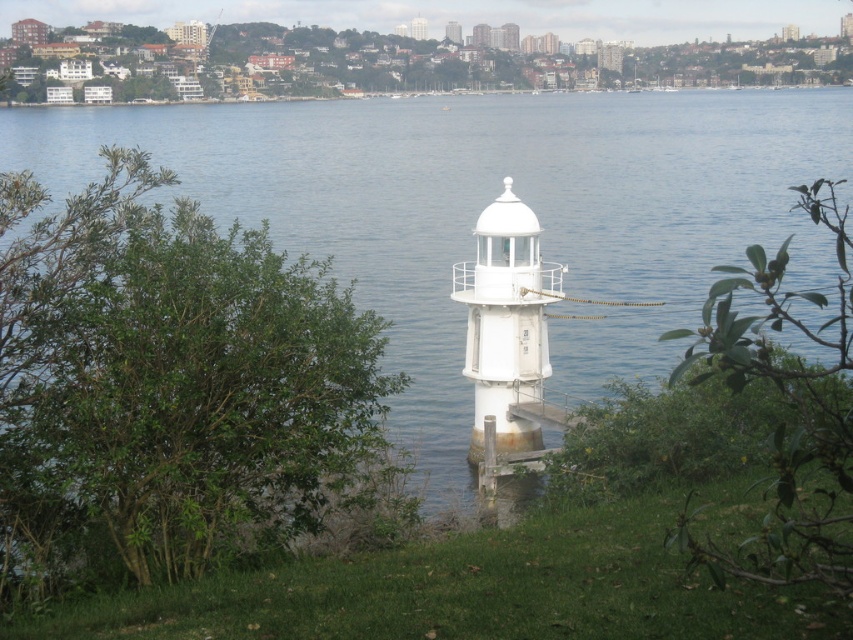
Is transparent water at center shorter than white matte/lightweight tower at center?

No, transparent water at center is not shorter than white matte/lightweight tower at center.

Can you confirm if transparent water at center is taller than white matte/lightweight tower at center?

Yes, transparent water at center is taller than white matte/lightweight tower at center.

Who is more distant from viewer, (248, 209) or (556, 272)?

Positioned behind is point (248, 209).

Image resolution: width=853 pixels, height=640 pixels. Identify the location of transparent water at center. (483, 205).

At what (x,y) coordinates should I click in order to perform the action: click on white matte/lightweight tower at center. Please return your answer as a coordinate pair (x, y). This screenshot has width=853, height=640. Looking at the image, I should click on (x=508, y=324).

Which is above, white matte/lightweight tower at center or white smooth tower at center?

white smooth tower at center is above.

The width and height of the screenshot is (853, 640). Describe the element at coordinates (508, 324) in the screenshot. I see `white matte/lightweight tower at center` at that location.

Locate an element on the screen. white matte/lightweight tower at center is located at coordinates (508, 324).

Which is below, transparent water at center or white smooth tower at center?

transparent water at center is below.

In the scene shown: Is transparent water at center smaller than white smooth tower at center?

Incorrect, transparent water at center is not smaller in size than white smooth tower at center.

Does point (393, 236) come closer to viewer compared to point (410, 33)?

Yes, point (393, 236) is closer to viewer.

Where is `transparent water at center`? The height and width of the screenshot is (640, 853). transparent water at center is located at coordinates (483, 205).